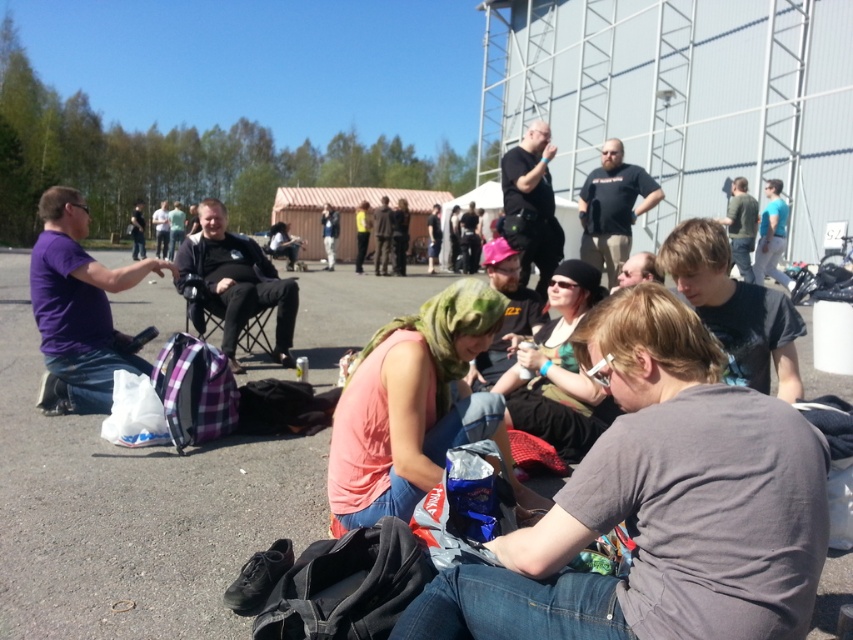
You are standing at the back of the scene and want to hand a gift to the person wearing the purple matte shirt at left and the black matte shirt at center. Which person should you approach first to reach them without obstructing your view?

You should approach the purple matte shirt at left first because they are in front of the black matte shirt at center, so you can reach them without obstruction.